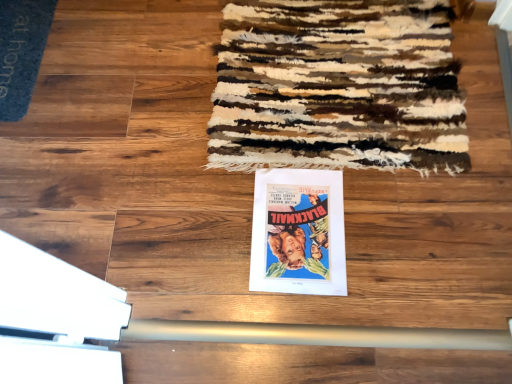
Find the location of a particular element. The height and width of the screenshot is (384, 512). vacant area that lies between matte paper poster at center and textured woolen mat at upper center is located at coordinates (350, 210).